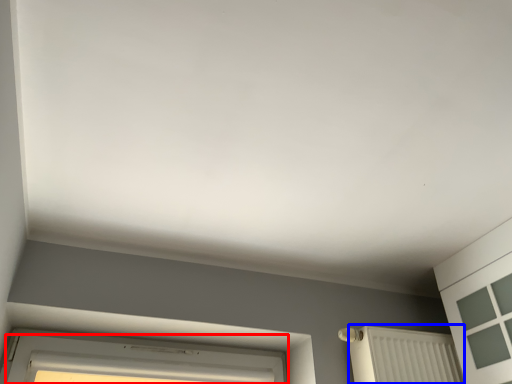
Question: Which point is closer to the camera, window (highlighted by a red box) or radiator (highlighted by a blue box)?

Choices:
 (A) window
 (B) radiator

Answer: (A)